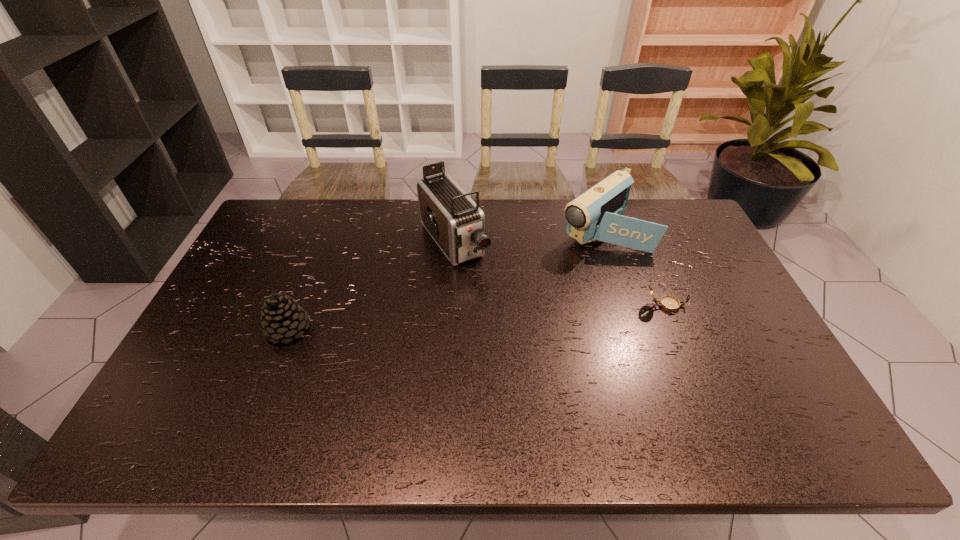
At what (x,y) coordinates should I click in order to perform the action: click on free space on the desktop that is between the leftmost object and the compass and is positioned on the side of the right camcorder with the flip-out screen. Please return your answer as a coordinate pair (x, y). Looking at the image, I should click on pos(491,316).

Find the location of a particular element. The height and width of the screenshot is (540, 960). vacant space on the desktop that is between the third tallest object and the compass and is positioned at the lens of the taller camcorder is located at coordinates (512, 315).